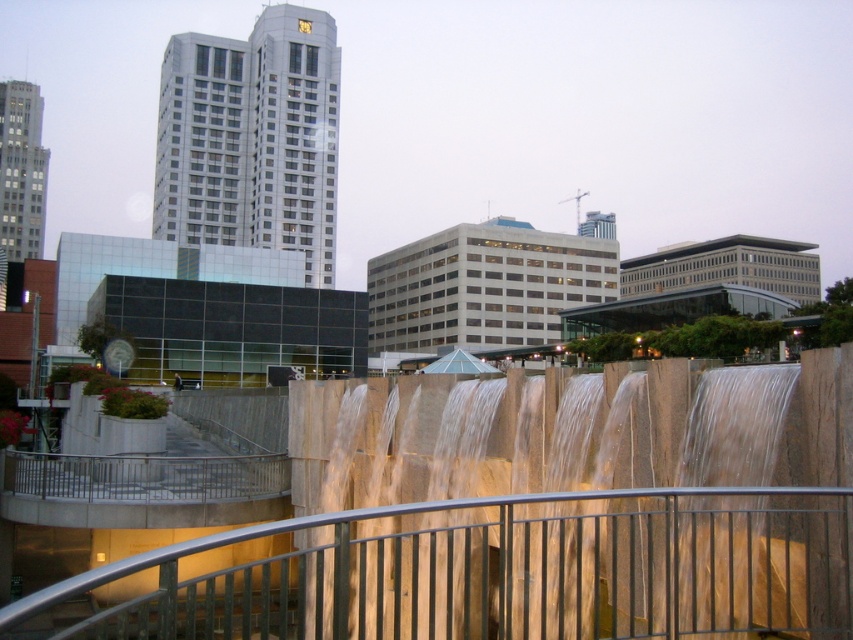
You are a maintenance worker needing to inspect the smooth stone waterfall at center and the metallic silver railing at lower center. Given that your inspection tool has a 24 inch reach, can you safely reach both objects from your current position without moving closer?

The smooth stone waterfall at center and metallic silver railing at lower center are 23.99 inches apart, so yes, the inspection tool with a 24 inch reach can safely reach both objects since the distance between them is just under 24 inches.

You are standing at the entrance of the urban park and want to locate the smooth stone waterfall at center. According to the coordinates provided, where should you look relative to the main skyscraper on the left?

The smooth stone waterfall at center is located at coordinates point [561,513], which is to the right and slightly forward of the main skyscraper on the left.

You are a maintenance worker needing to inspect both the smooth stone waterfall at center and the metallic silver railing at lower center. Which object should you check first if you want to start with the taller one?

You should check the metallic silver railing at lower center first because it is taller than the smooth stone waterfall at center according to the description.